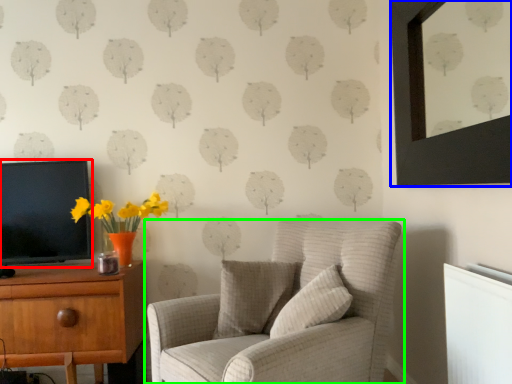
Question: Based on their relative distances, which object is nearer to television (highlighted by a red box)? Choose from picture frame (highlighted by a blue box) and chair (highlighted by a green box).

Choices:
 (A) picture frame
 (B) chair

Answer: (B)